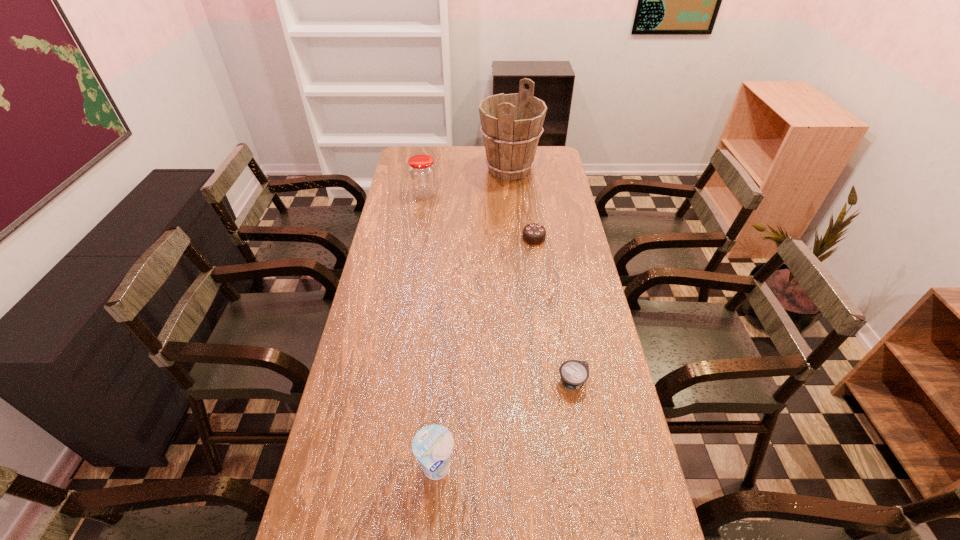
The height and width of the screenshot is (540, 960). In order to click on blank space at the far edge of the desktop in this screenshot , I will do 460,159.

Find the location of a particular element. The width and height of the screenshot is (960, 540). free point at the left edge is located at coordinates (396, 183).

This screenshot has height=540, width=960. I want to click on vacant space at the right edge of the desktop, so click(x=552, y=187).

Find the location of `free space between the second tallest object and the shortest object`. free space between the second tallest object and the shortest object is located at coordinates (498, 287).

At what (x,y) coordinates should I click in order to perform the action: click on vacant area that lies between the shortest object and the chocolate cake. Please return your answer as a coordinate pair (x, y). The height and width of the screenshot is (540, 960). Looking at the image, I should click on (553, 310).

The image size is (960, 540). I want to click on free spot between the third nearest object and the leftmost object, so click(x=479, y=215).

Find the location of a particular element. This screenshot has width=960, height=540. vacant space that's between the third farthest object and the tallest object is located at coordinates (521, 204).

Where is `free point between the bucket and the third farthest object`? free point between the bucket and the third farthest object is located at coordinates (521, 204).

The width and height of the screenshot is (960, 540). I want to click on vacant area that lies between the tallest object and the second tallest object, so click(467, 182).

Locate an element on the screen. This screenshot has height=540, width=960. vacant area that lies between the leftmost object and the bucket is located at coordinates (467, 182).